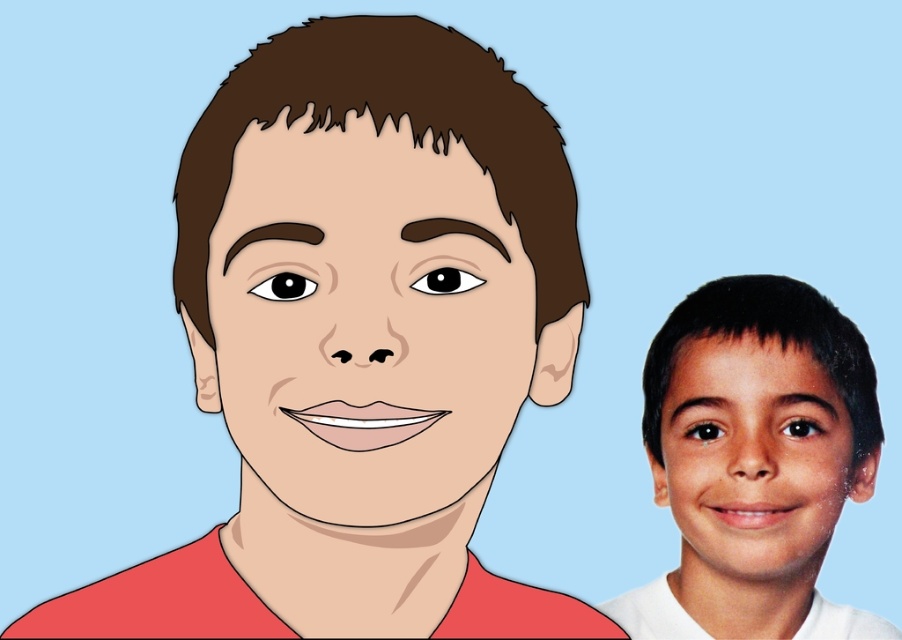
Question: Among these objects, which one is nearest to the camera?

Choices:
 (A) smooth skin face at right
 (B) matte red shirt at center
 (C) smooth skin child at right
 (D) smooth skin face at center

Answer: (B)

Question: Is matte red shirt at center further to camera compared to smooth skin child at right?

Choices:
 (A) yes
 (B) no

Answer: (B)

Question: Is matte red shirt at center thinner than smooth skin face at center?

Choices:
 (A) yes
 (B) no

Answer: (B)

Question: Considering the real-world distances, which object is closest to the smooth skin face at right?

Choices:
 (A) smooth skin child at right
 (B) matte red shirt at center
 (C) smooth skin face at center

Answer: (A)

Question: Which point appears farthest from the camera in this image?

Choices:
 (A) (769, 627)
 (B) (272, 544)
 (C) (477, 394)

Answer: (A)

Question: Is smooth skin child at right to the left of smooth skin face at right from the viewer's perspective?

Choices:
 (A) yes
 (B) no

Answer: (B)